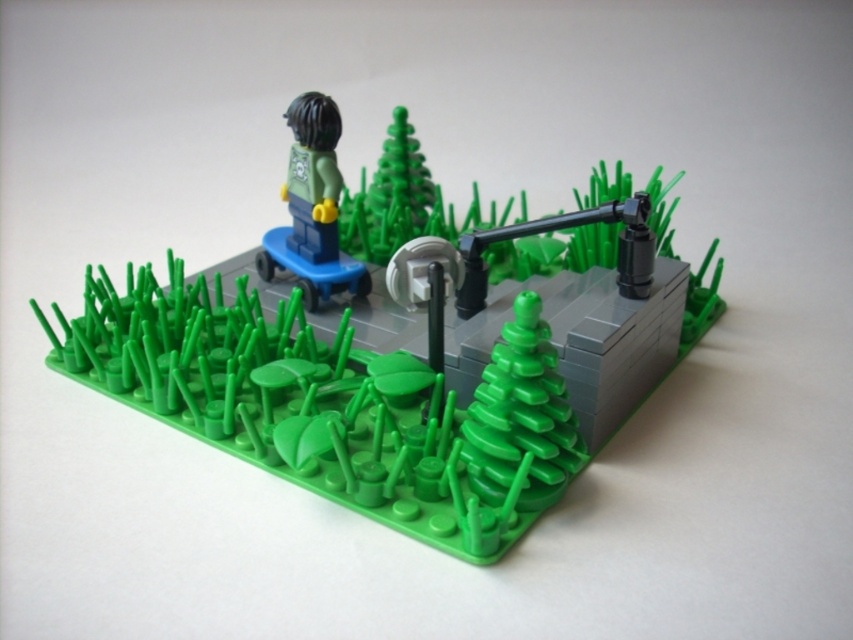
You are a LEGO figure standing on the pathway in the miniature park scene. You want to place your green matte skateboard at upper left next to the matte green tree at center. Can the skateboard fit next to the tree without overlapping?

The matte green tree at center might be wider than the green matte skateboard at upper left, so there is a possibility that the skateboard cannot fit next to the tree without overlapping. Check the width of both objects to ensure they can be placed side by side.